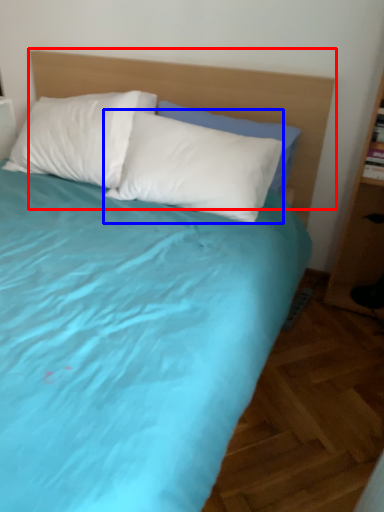
Question: Which object is further to the camera taking this photo, headboard (highlighted by a red box) or pillow (highlighted by a blue box)?

Choices:
 (A) headboard
 (B) pillow

Answer: (B)